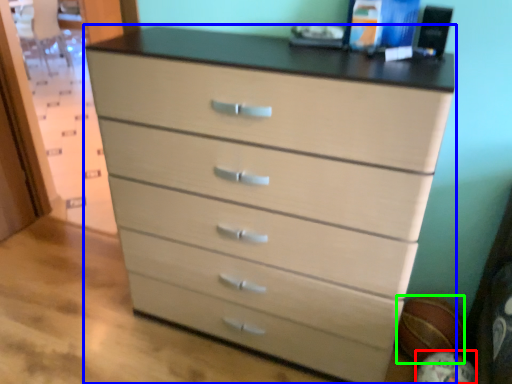
Question: Estimate the real-world distances between objects in this image. Which object is farther from basketball (highlighted by a red box), chest of drawers (highlighted by a blue box) or basketball (highlighted by a green box)?

Choices:
 (A) chest of drawers
 (B) basketball

Answer: (A)